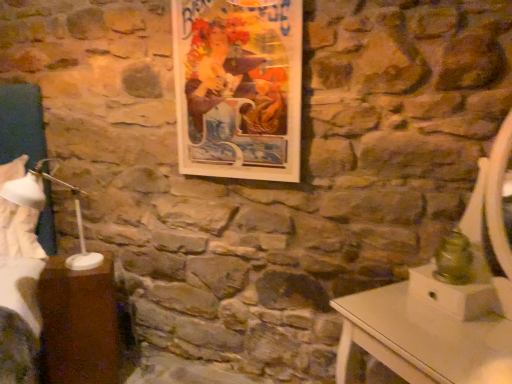
Question: In terms of size, does white fabric at left appear bigger or smaller than wooden picture frame at upper center?

Choices:
 (A) small
 (B) big

Answer: (B)

Question: From a real-world perspective, relative to wooden picture frame at upper center, is white fabric at left vertically above or below?

Choices:
 (A) above
 (B) below

Answer: (B)

Question: Estimate the real-world distances between objects in this image. Which object is closer to the wooden picture frame at upper center?

Choices:
 (A) white plastic bedside lamp at left
 (B) brown wood table at lower left
 (C) white fabric at left

Answer: (A)

Question: Which object is positioned farthest from the brown wood table at lower left?

Choices:
 (A) white fabric at left
 (B) wooden picture frame at upper center
 (C) white plastic bedside lamp at left

Answer: (B)